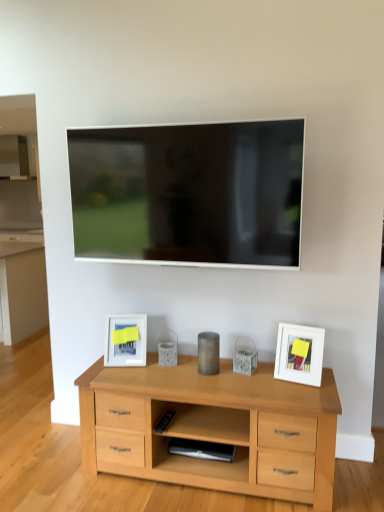
At what (x,y) coordinates should I click in order to perform the action: click on vacant region above matte black tv at upper center (from a real-world perspective). Please return your answer as a coordinate pair (x, y). Looking at the image, I should click on pos(172,126).